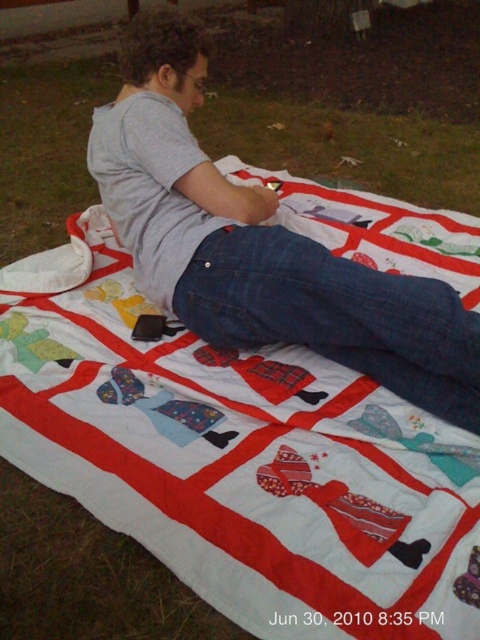
Question: From the image, what is the correct spatial relationship of gray cotton shirt at upper center in relation to denim at center?

Choices:
 (A) above
 (B) below

Answer: (A)

Question: Which object appears closest to the camera in this image?

Choices:
 (A) denim at center
 (B) gray cotton shirt at upper center

Answer: (A)

Question: Is gray cotton shirt at upper center above denim at center?

Choices:
 (A) yes
 (B) no

Answer: (A)

Question: Which of the following is the closest to the observer?

Choices:
 (A) denim at center
 (B) gray cotton shirt at upper center

Answer: (A)

Question: Is gray cotton shirt at upper center to the right of denim at center from the viewer's perspective?

Choices:
 (A) no
 (B) yes

Answer: (A)